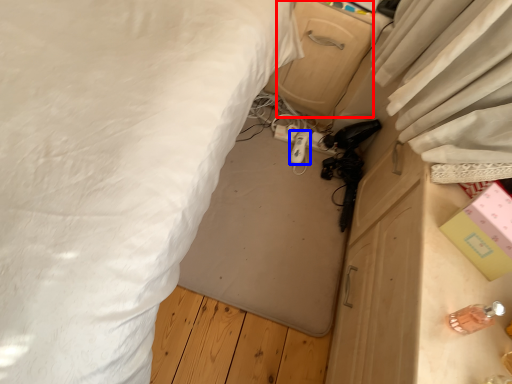
Question: Which point is further to the camera, drawer (highlighted by a red box) or equipment (highlighted by a blue box)?

Choices:
 (A) drawer
 (B) equipment

Answer: (B)